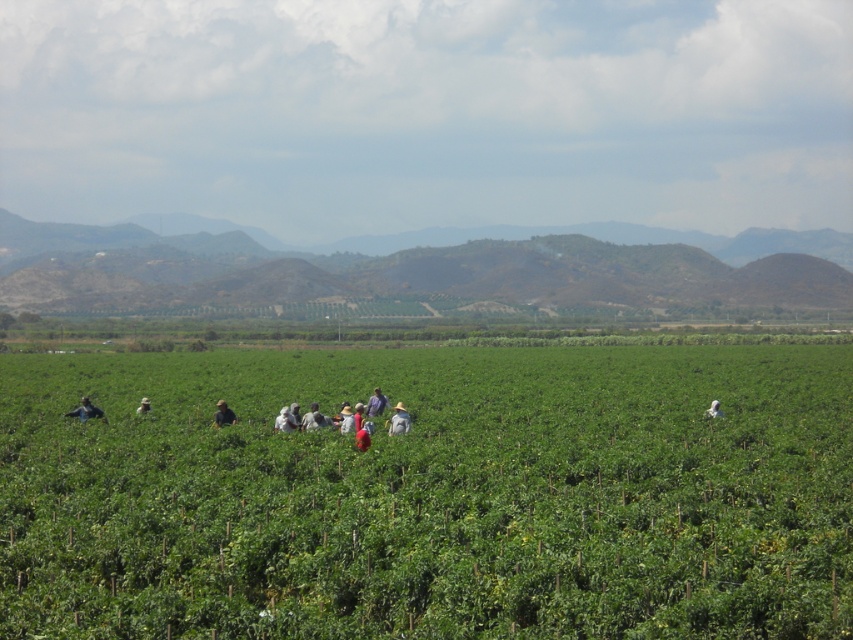
Who is lower down, green leafy plants at center or dark blue shirt at lower left?

green leafy plants at center is lower down.

Locate an element on the screen. This screenshot has width=853, height=640. green leafy plants at center is located at coordinates (431, 493).

Can you confirm if white fabric hat at center is thinner than purple fabric at center?

No.

Who is more distant from viewer, [402,412] or [383,397]?

The point [383,397] is behind.

Find the location of a particular element. white fabric hat at center is located at coordinates (399, 420).

Is purple fabric at center positioned behind light brown fabric hat at center?

Yes, it is behind light brown fabric hat at center.

Is point (376, 397) more distant than point (283, 413)?

Yes, it is.

What are the coordinates of `purple fabric at center` in the screenshot? It's located at (376, 403).